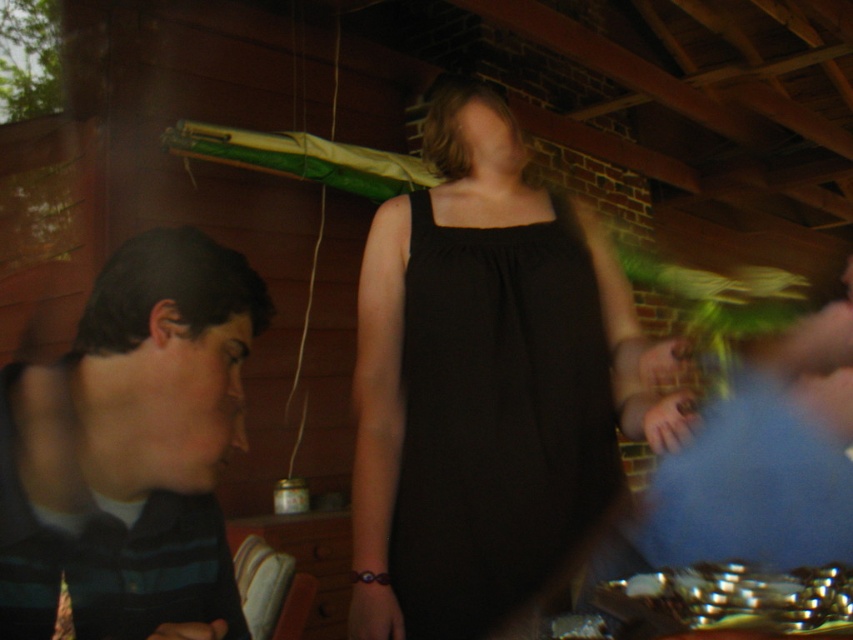
Question: Is striped fabric shirt at left thinner than black matte dress at center?

Choices:
 (A) no
 (B) yes

Answer: (B)

Question: Which is nearer to the striped fabric shirt at left?

Choices:
 (A) shiny metallic utensils at lower right
 (B) black matte dress at center

Answer: (B)

Question: Based on their relative distances, which object is nearer to the shiny metallic utensils at lower right?

Choices:
 (A) black matte dress at center
 (B) striped fabric shirt at left

Answer: (A)

Question: Which point appears farthest from the camera in this image?

Choices:
 (A) (228, 298)
 (B) (584, 250)

Answer: (B)

Question: Is black matte dress at center to the right of shiny metallic utensils at lower right from the viewer's perspective?

Choices:
 (A) no
 (B) yes

Answer: (A)

Question: Is black matte dress at center smaller than shiny metallic utensils at lower right?

Choices:
 (A) yes
 (B) no

Answer: (B)